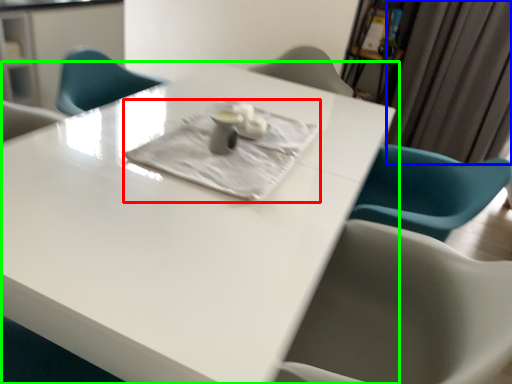
Question: Which is nearer to the cloth (highlighted by a red box)? curtain (highlighted by a blue box) or table (highlighted by a green box).

Choices:
 (A) curtain
 (B) table

Answer: (B)